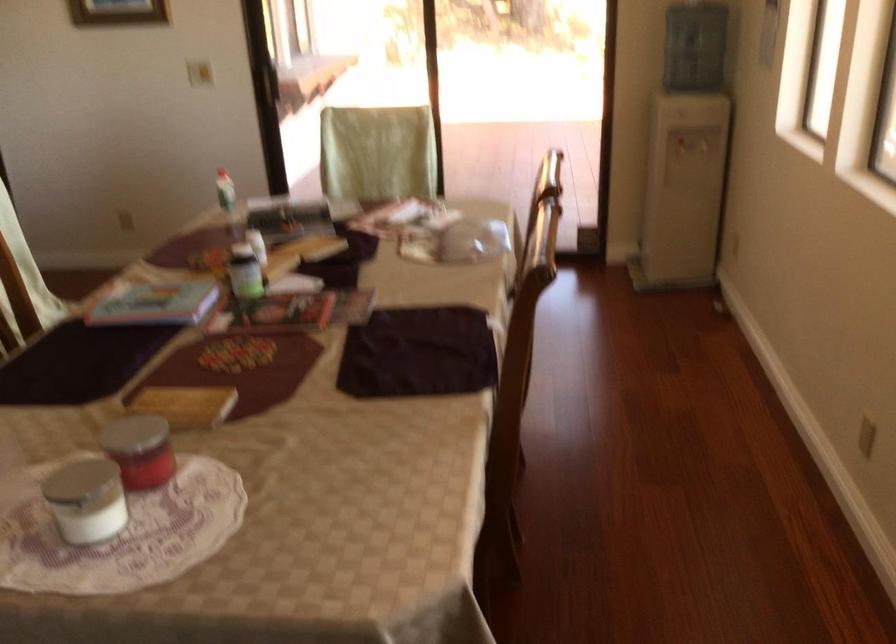
Describe the element at coordinates (162, 465) in the screenshot. I see `the red jar lid` at that location.